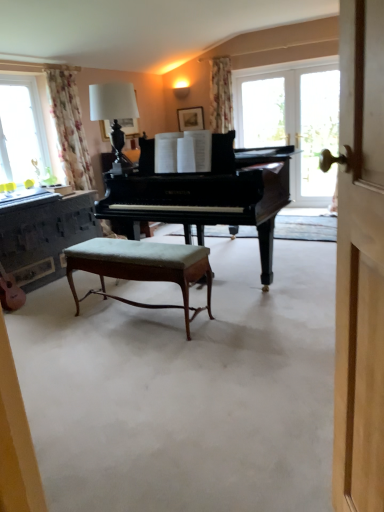
Identify the location of vacant space in green fabric stool at center (from a real-world perspective). (142, 318).